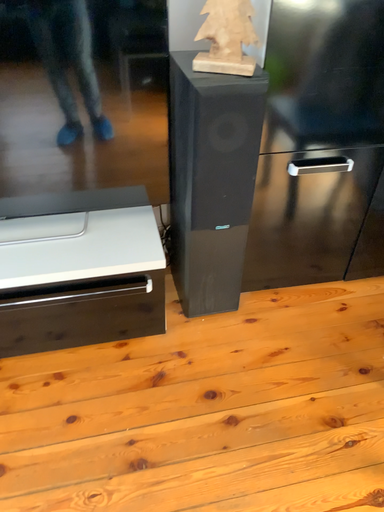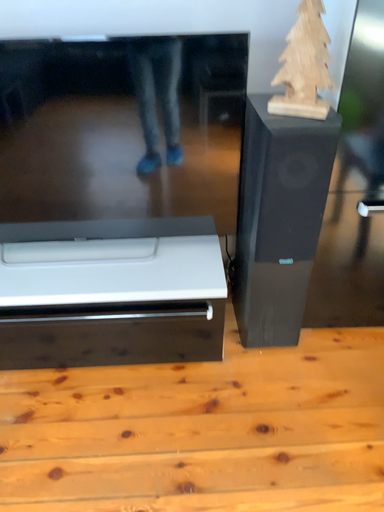
Question: Which way did the camera rotate in the video?

Choices:
 (A) rotated left
 (B) rotated right

Answer: (A)